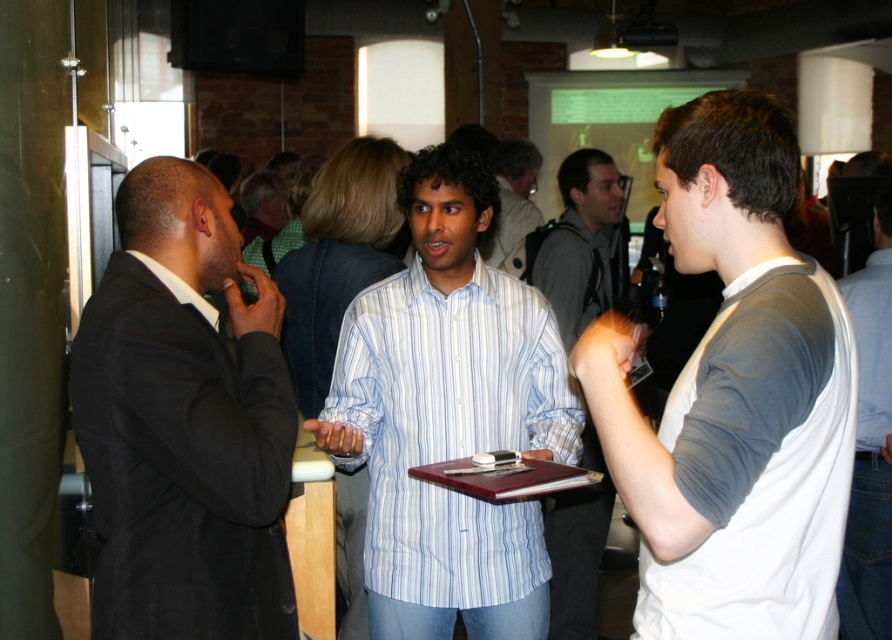
In the scene shown: Can you confirm if white striped shirt at center is smaller than light blue striped shirt at center?

No.

Does point (472, 392) come behind point (502, 243)?

No, it is in front of (502, 243).

This screenshot has height=640, width=892. I want to click on white striped shirt at center, so click(449, 417).

Between white cotton t-shirt at right and black matte suit at left, which one appears on the left side from the viewer's perspective?

black matte suit at left is more to the left.

Is point (670, 636) positioned after point (143, 456)?

No, it is in front of (143, 456).

Where is `white cotton t-shirt at right`? This screenshot has width=892, height=640. white cotton t-shirt at right is located at coordinates (734, 396).

The image size is (892, 640). What do you see at coordinates (870, 442) in the screenshot? I see `white fabric shirt at center` at bounding box center [870, 442].

Does white fabric shirt at center have a greater height compared to light blue striped shirt at center?

Yes, white fabric shirt at center is taller than light blue striped shirt at center.

Does point (888, 186) come closer to viewer compared to point (500, 164)?

Yes, point (888, 186) is closer to viewer.

Identify the location of white fabric shirt at center. This screenshot has width=892, height=640. (870, 442).